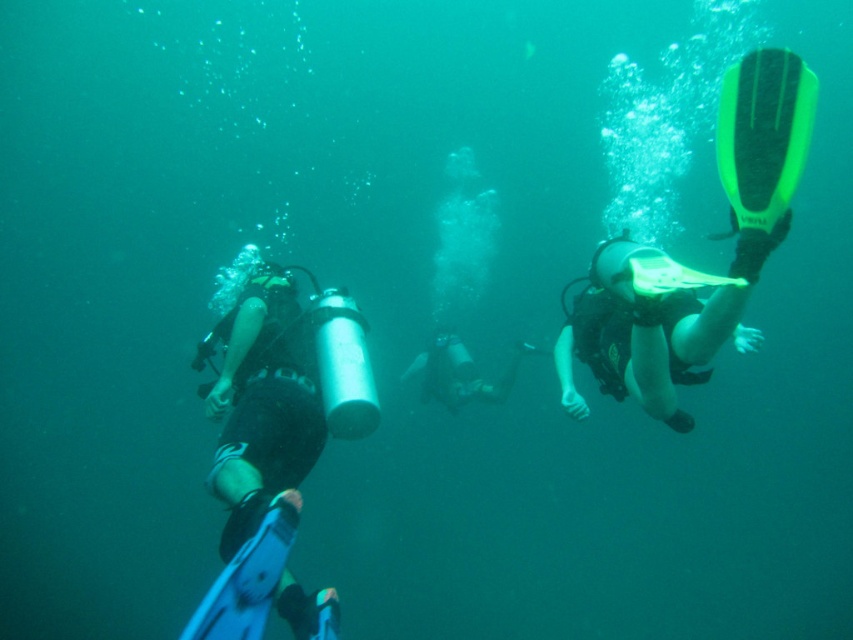
Question: Does black matte wetsuit at left lie behind neon yellow rubber fin at right?

Choices:
 (A) yes
 (B) no

Answer: (A)

Question: Which object is positioned closest to the black matte wetsuit at left?

Choices:
 (A) neon yellow rubber fin at right
 (B) black matte wetsuit at center

Answer: (A)

Question: Is black matte wetsuit at left wider than neon yellow rubber fin at right?

Choices:
 (A) no
 (B) yes

Answer: (B)

Question: Which point is farther from the camera taking this photo?

Choices:
 (A) (676, 369)
 (B) (509, 388)
 (C) (326, 621)

Answer: (B)

Question: Is black matte wetsuit at left positioned before neon yellow rubber fin at right?

Choices:
 (A) no
 (B) yes

Answer: (A)

Question: Which object is positioned farthest from the black matte wetsuit at left?

Choices:
 (A) black matte wetsuit at center
 (B) neon yellow rubber fin at right

Answer: (A)